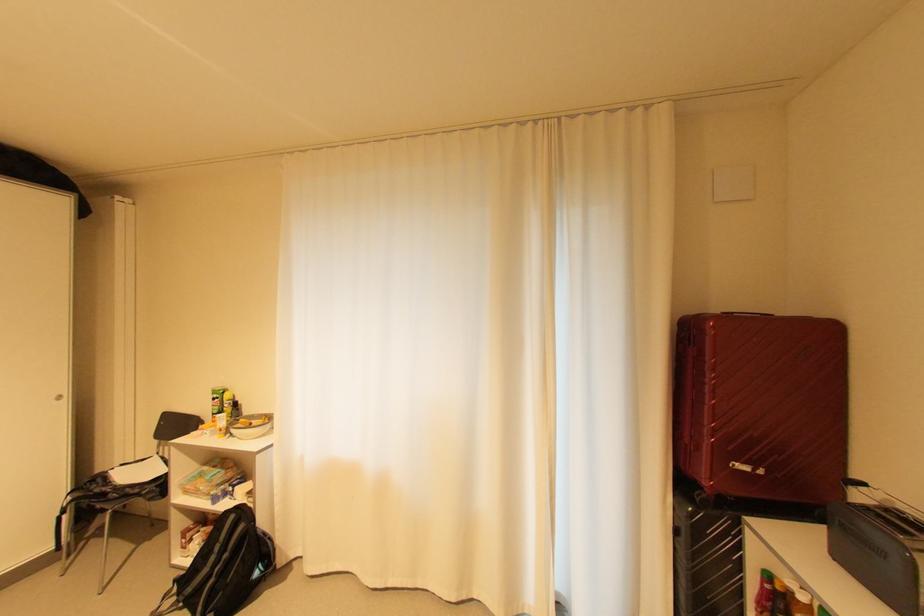
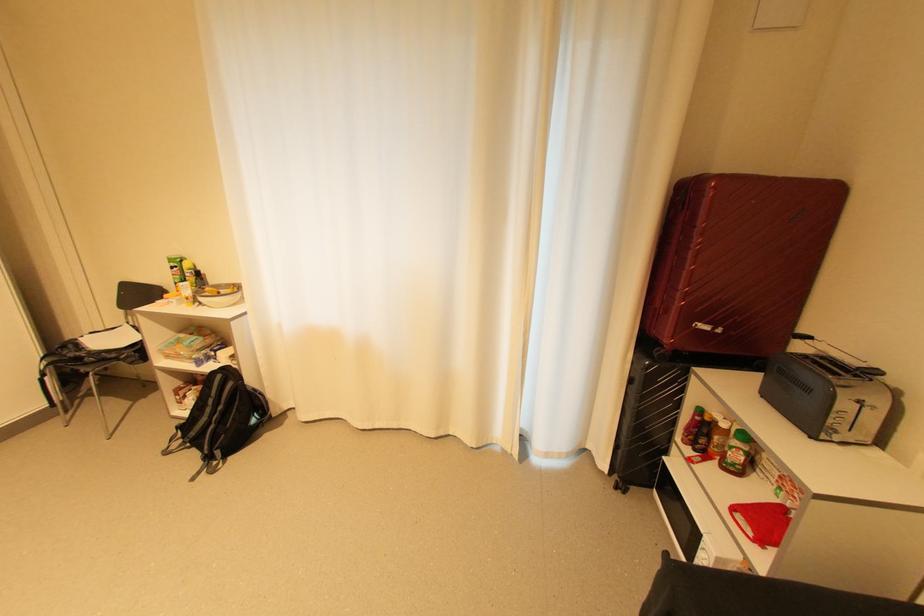
The point at [224,395] is marked in the first image. Where is the corresponding point in the second image?

(180, 265)